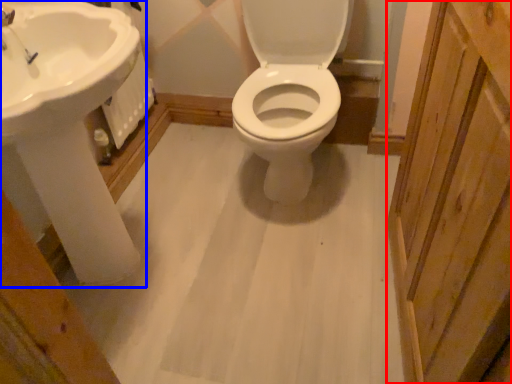
Question: Which object is closer to the camera taking this photo, screen door (highlighted by a red box) or sink (highlighted by a blue box)?

Choices:
 (A) screen door
 (B) sink

Answer: (A)